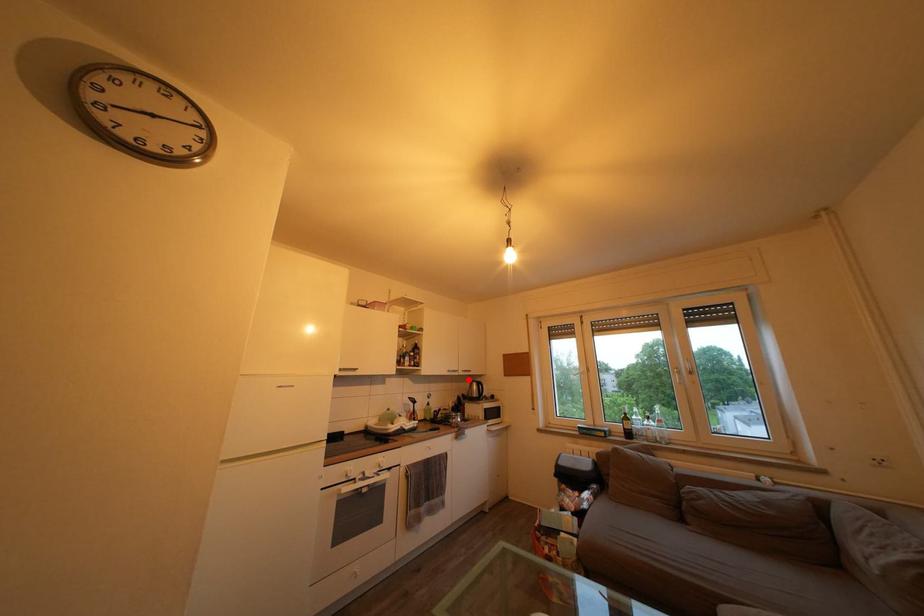
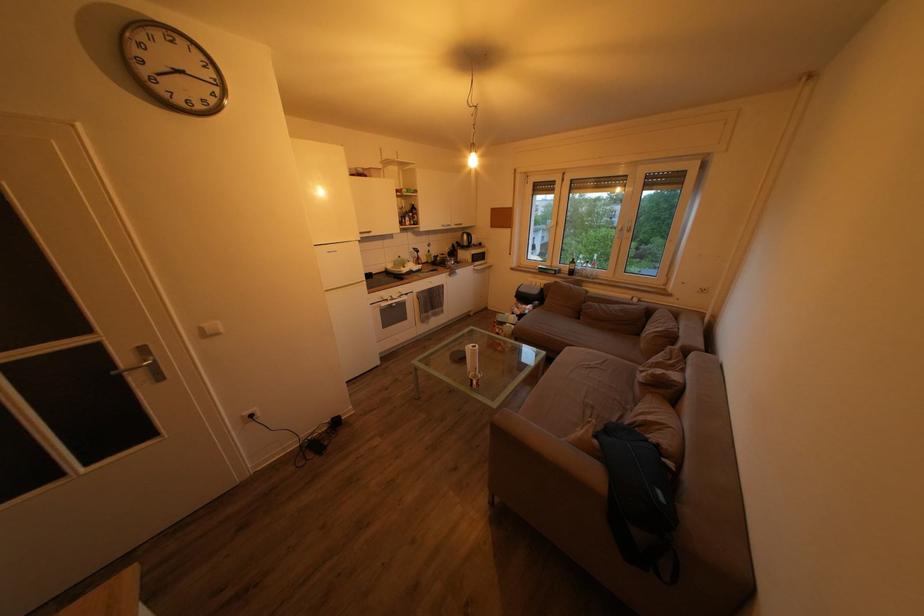
Question: I am providing you with two images of the same scene from different viewpoints. A red point is shown in image1. For the corresponding object point in image2, is it positioned nearer or farther from the camera?

Choices:
 (A) Nearer
 (B) Farther

Answer: (A)